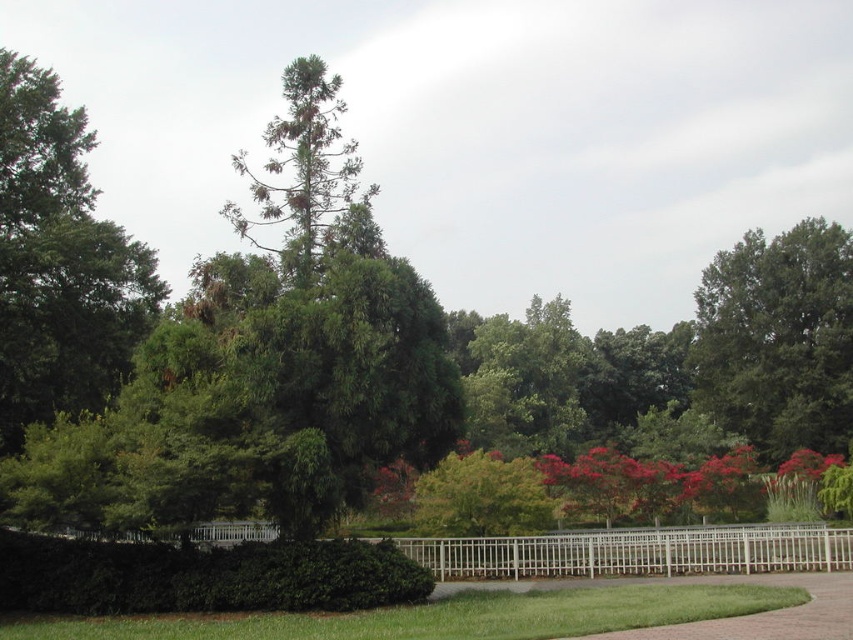
Can you confirm if green leafy tree at left is smaller than green leafy tree at upper right?

Indeed, green leafy tree at left has a smaller size compared to green leafy tree at upper right.

Is green leafy tree at left shorter than green leafy tree at upper right?

Indeed, green leafy tree at left has a lesser height compared to green leafy tree at upper right.

Between point (125, 337) and point (706, 300), which one is positioned in front?

Point (125, 337)

Image resolution: width=853 pixels, height=640 pixels. Identify the location of green leafy tree at left. (59, 260).

Does green leafy tree at left appear under white wooden fence at center?

Incorrect, green leafy tree at left is not positioned below white wooden fence at center.

Can you confirm if green leafy tree at left is shorter than white wooden fence at center?

Incorrect, green leafy tree at left's height does not fall short of white wooden fence at center's.

The width and height of the screenshot is (853, 640). Find the location of `green leafy tree at left`. green leafy tree at left is located at coordinates (59, 260).

Is green leafy tree at upper right to the right of white wooden fence at center from the viewer's perspective?

Indeed, green leafy tree at upper right is positioned on the right side of white wooden fence at center.

Identify the location of green leafy tree at upper right. (778, 339).

You are a GUI agent. You are given a task and a screenshot of the screen. Output one action in this format:
    pyautogui.click(x=<x>, y=<y>)
    Task: Click on the green leafy tree at upper right
    The width and height of the screenshot is (853, 640).
    Given the screenshot: What is the action you would take?
    pyautogui.click(x=778, y=339)